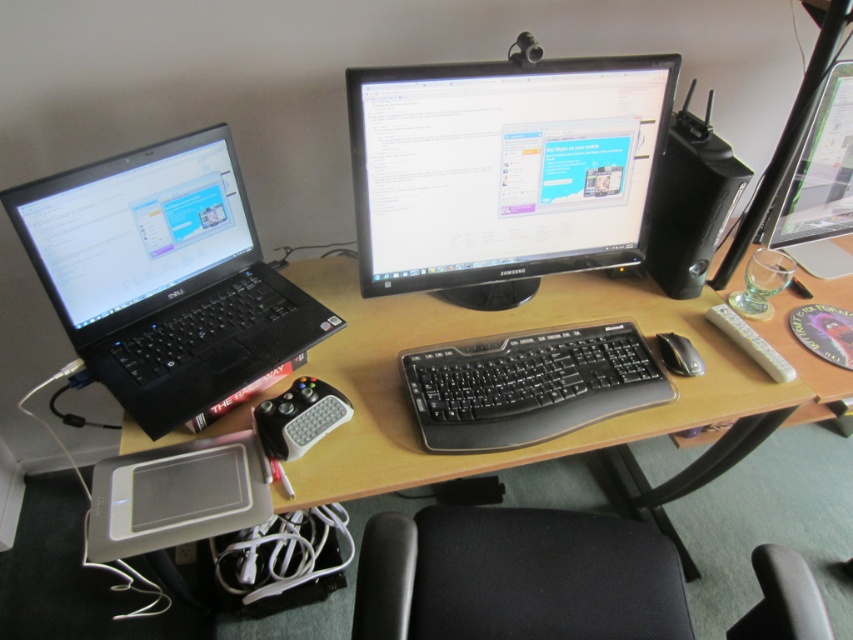
Which is in front, point (393, 312) or point (689, 262)?

Point (393, 312) is more forward.

Who is taller, wooden desk at center or black plastic speaker at right?

wooden desk at center is taller.

This screenshot has width=853, height=640. I want to click on wooden desk at center, so click(x=534, y=330).

Is black glossy monitor at center behind black plastic laptop at left?

That is True.

Find the location of a particular element. The width and height of the screenshot is (853, 640). black glossy monitor at center is located at coordinates (502, 172).

Between black plastic laptop at left and black plastic speaker at right, which one has more height?

black plastic laptop at left is taller.

Who is more forward, (137, 310) or (666, 140)?

Positioned in front is point (137, 310).

Where is `black plastic laptop at left`? The height and width of the screenshot is (640, 853). black plastic laptop at left is located at coordinates (163, 276).